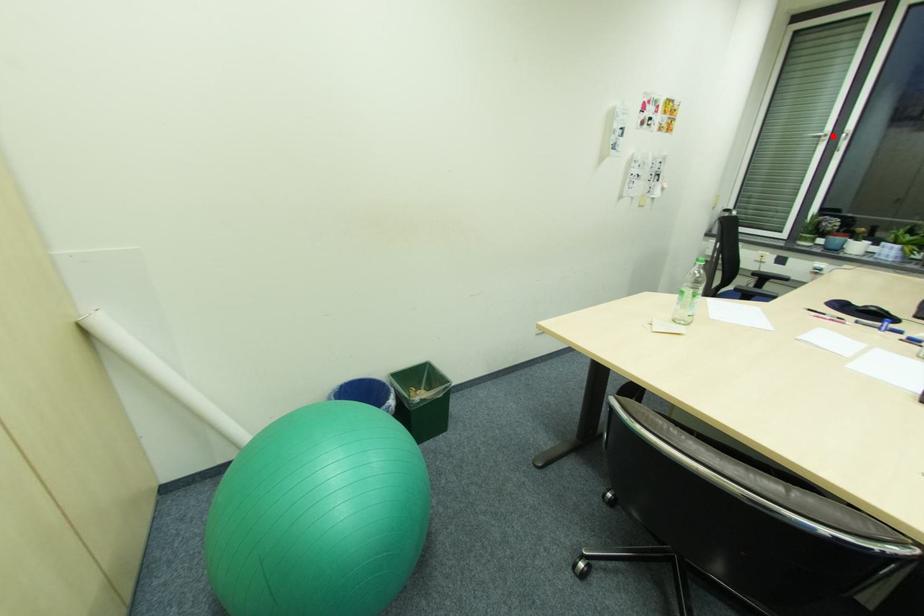
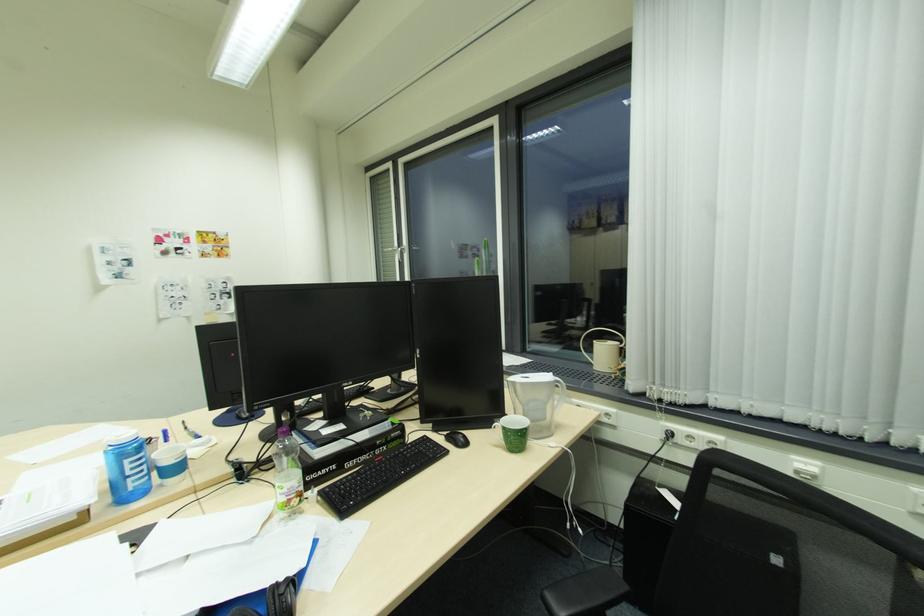
The point at the highlighted location is marked in the first image. Where is the corresponding point in the second image?

(400, 251)